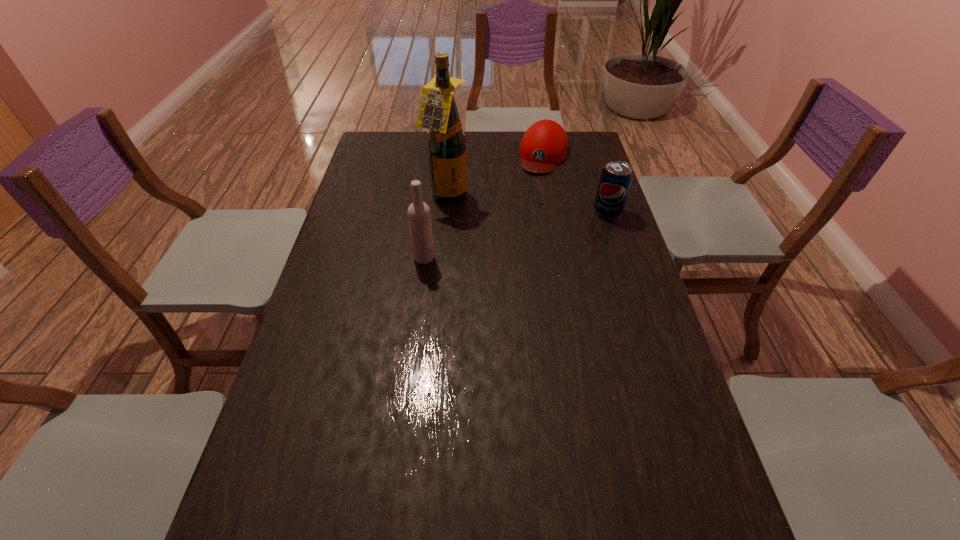
Image resolution: width=960 pixels, height=540 pixels. Find the location of `free space located on the front-facing side of the liquor`. free space located on the front-facing side of the liquor is located at coordinates (496, 229).

The height and width of the screenshot is (540, 960). Find the location of `blank space located 0.380m on the front-facing side of the liquor`. blank space located 0.380m on the front-facing side of the liquor is located at coordinates (x=551, y=264).

Identify the location of free space located 0.070m on the front-facing side of the third object from left to right. (537, 186).

You are a GUI agent. You are given a task and a screenshot of the screen. Output one action in this format:
    pyautogui.click(x=<x>, y=<y>)
    Task: Click on the free spot located on the front-facing side of the third object from left to right
    The image size is (960, 540).
    Given the screenshot: What is the action you would take?
    coord(536,189)

Image resolution: width=960 pixels, height=540 pixels. I want to click on vacant space situated on the front-facing side of the third object from left to right, so click(x=531, y=202).

Image resolution: width=960 pixels, height=540 pixels. What are the coordinates of `object that is at the far edge` in the screenshot? It's located at (544, 144).

Find the location of `soda can that is at the right edge`. soda can that is at the right edge is located at coordinates (616, 178).

At what (x,y) coordinates should I click in order to perform the action: click on baseball cap at the right edge. Please return your answer as a coordinate pair (x, y). Image resolution: width=960 pixels, height=540 pixels. Looking at the image, I should click on (544, 144).

At what (x,y) coordinates should I click in order to perform the action: click on object located in the far right corner section of the desktop. Please return your answer as a coordinate pair (x, y). Looking at the image, I should click on (544, 144).

In the image, there is a desktop. Identify the location of vacant space at the far edge. [x=513, y=161].